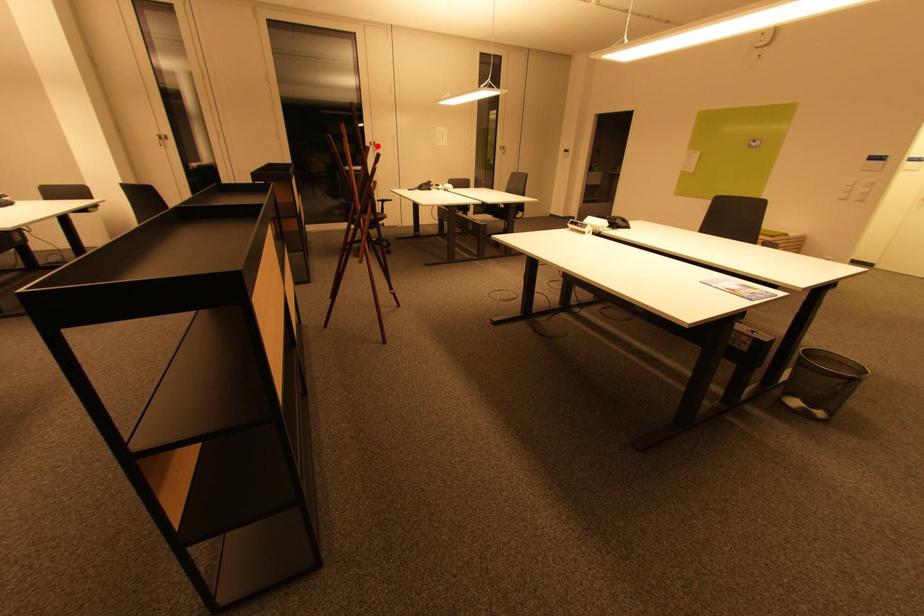
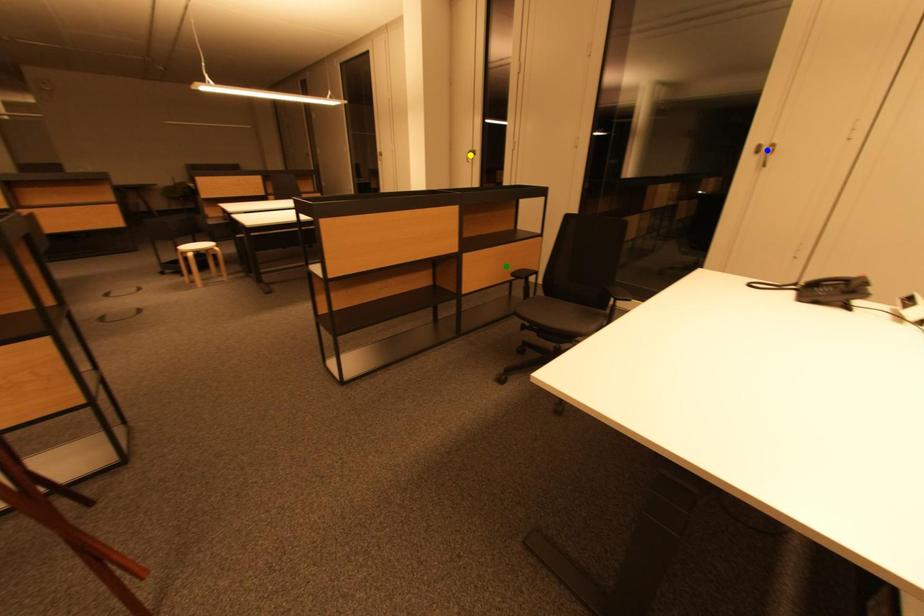
Question: I am providing you with two images of the same scene from different viewpoints. A red point is marked on the first image. You are given multiple points on the second image. Which point in image 2 is actually the same real-world point as the red point in image 1?

Choices:
 (A) yellow point
 (B) blue point
 (C) green point

Answer: (B)